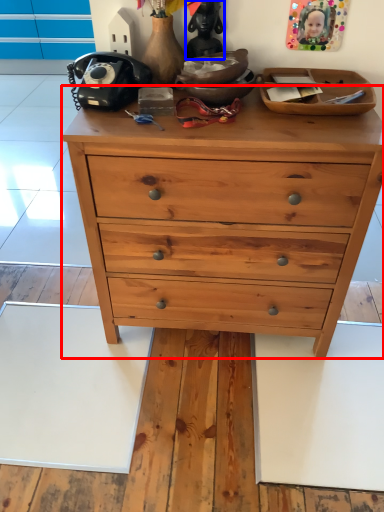
Question: Which point is further to the camera, chest of drawers (highlighted by a red box) or toy (highlighted by a blue box)?

Choices:
 (A) chest of drawers
 (B) toy

Answer: (B)